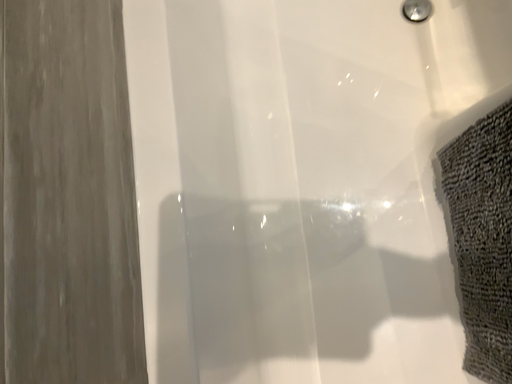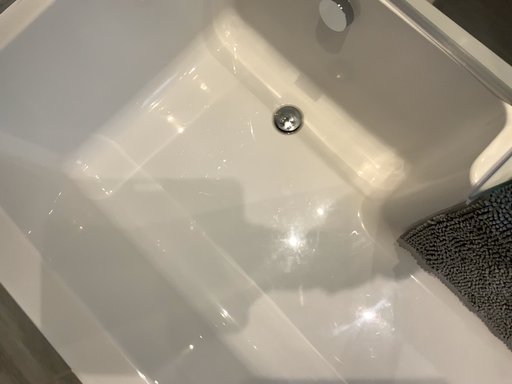
Question: Which way did the camera rotate in the video?

Choices:
 (A) rotated right
 (B) rotated left

Answer: (A)